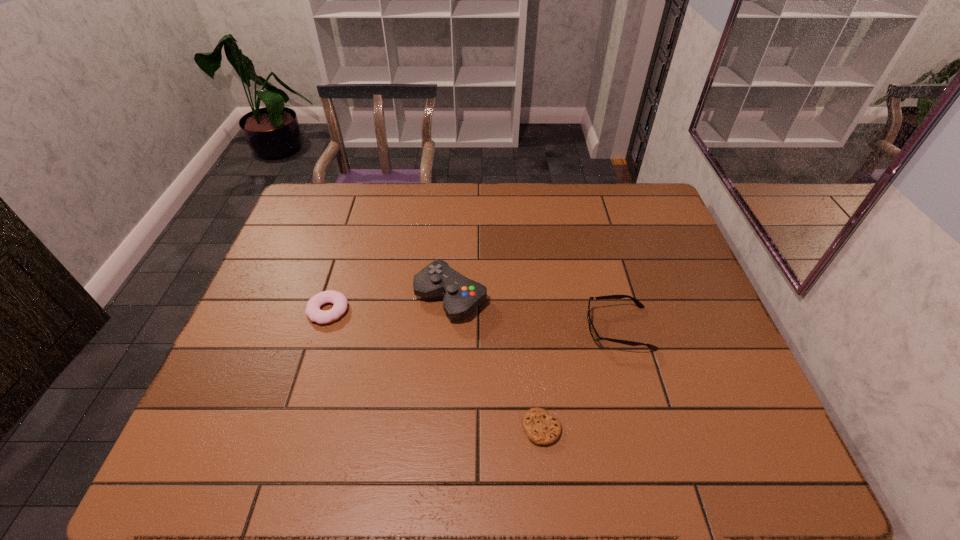
Identify the location of vacant space at the far left corner. This screenshot has height=540, width=960. (324, 224).

Find the location of `empty space between the control and the spectacles`. empty space between the control and the spectacles is located at coordinates (535, 313).

Where is `vacant area that lies between the tallest object and the nearest object`? The height and width of the screenshot is (540, 960). vacant area that lies between the tallest object and the nearest object is located at coordinates (496, 362).

At what (x,y) coordinates should I click in order to perform the action: click on free point between the cookie and the rightmost object. Please return your answer as a coordinate pair (x, y). This screenshot has width=960, height=540. Looking at the image, I should click on (580, 378).

Identify the location of unoccupied position between the second object from left to right and the second tallest object. Image resolution: width=960 pixels, height=540 pixels. (535, 313).

I want to click on free space between the tallest object and the nearest object, so click(496, 362).

You are a GUI agent. You are given a task and a screenshot of the screen. Output one action in this format:
    pyautogui.click(x=<x>, y=<y>)
    Task: Click on the vacant space that's between the third object from left to right and the third shortest object
    
    Given the screenshot: What is the action you would take?
    pyautogui.click(x=580, y=378)

Image resolution: width=960 pixels, height=540 pixels. Identify the location of free area in between the second shortest object and the second tallest object. (473, 319).

The width and height of the screenshot is (960, 540). What are the coordinates of `free space between the doughnut and the second object from left to right` in the screenshot? It's located at (390, 303).

Locate an element on the screen. This screenshot has width=960, height=540. vacant region between the spectacles and the cookie is located at coordinates (580, 378).